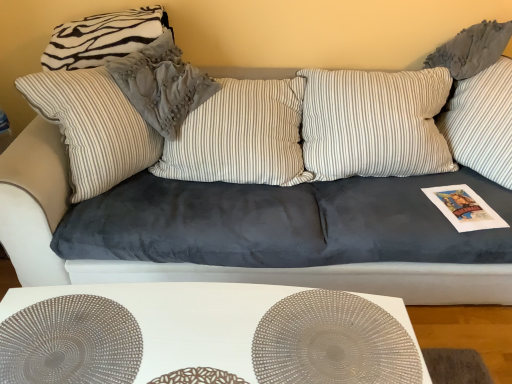
Question: Would you consider white matte table at lower center to be distant from translucent plastic circle at center, the 1th circle positioned from the right?

Choices:
 (A) no
 (B) yes

Answer: (A)

Question: Is translucent plastic circle at center, marked as the second circle in a left-to-right arrangement, a part of white matte table at lower center?

Choices:
 (A) no
 (B) yes

Answer: (B)

Question: Is white matte table at lower center positioned before translucent plastic circle at center, the 1th circle positioned from the right?

Choices:
 (A) yes
 (B) no

Answer: (B)

Question: From the image's perspective, is white matte table at lower center over translucent plastic circle at center, marked as the second circle in a left-to-right arrangement?

Choices:
 (A) no
 (B) yes

Answer: (A)

Question: From the image's perspective, is white matte table at lower center beneath translucent plastic circle at center, the 1th circle positioned from the right?

Choices:
 (A) yes
 (B) no

Answer: (A)

Question: Is white matte table at lower center outside translucent plastic circle at center, the 1th circle positioned from the right?

Choices:
 (A) yes
 (B) no

Answer: (A)

Question: Does zebra-patterned fabric pillow at upper left, which ranks as the second pillow in right-to-left order, contain satin silver circle at center, marked as the second circle in a right-to-left arrangement?

Choices:
 (A) yes
 (B) no

Answer: (B)

Question: Can you confirm if zebra-patterned fabric pillow at upper left, which is counted as the 1th pillow, starting from the left, is wider than satin silver circle at center, marked as the second circle in a right-to-left arrangement?

Choices:
 (A) no
 (B) yes

Answer: (A)

Question: Is zebra-patterned fabric pillow at upper left, which is counted as the 1th pillow, starting from the left, positioned with its back to satin silver circle at center, marked as the second circle in a right-to-left arrangement?

Choices:
 (A) yes
 (B) no

Answer: (B)

Question: Is the position of zebra-patterned fabric pillow at upper left, which ranks as the second pillow in right-to-left order, less distant than that of satin silver circle at center, marked as the second circle in a right-to-left arrangement?

Choices:
 (A) yes
 (B) no

Answer: (B)

Question: Can you confirm if zebra-patterned fabric pillow at upper left, which ranks as the second pillow in right-to-left order, is positioned to the left of satin silver circle at center, marked as the second circle in a right-to-left arrangement?

Choices:
 (A) yes
 (B) no

Answer: (A)

Question: Considering the relative sizes of zebra-patterned fabric pillow at upper left, which ranks as the second pillow in right-to-left order, and satin silver circle at center, which is the first circle from left to right, in the image provided, is zebra-patterned fabric pillow at upper left, which ranks as the second pillow in right-to-left order, smaller than satin silver circle at center, which is the first circle from left to right,?

Choices:
 (A) yes
 (B) no

Answer: (B)

Question: Is striped fabric pillow at upper left, arranged as the second pillow when viewed from the left, a part of zebra-patterned fabric pillow at upper left, which is counted as the 1th pillow, starting from the left?

Choices:
 (A) no
 (B) yes

Answer: (A)